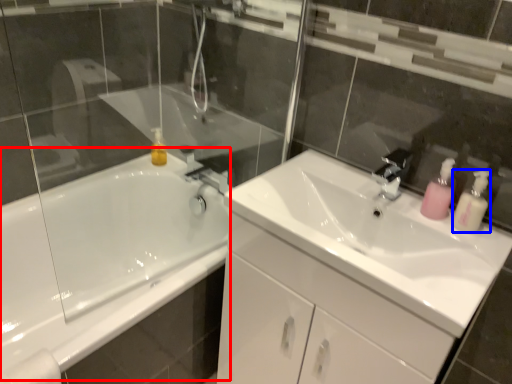
Question: Which object is closer to the camera taking this photo, bath (highlighted by a red box) or soap dispenser (highlighted by a blue box)?

Choices:
 (A) bath
 (B) soap dispenser

Answer: (A)